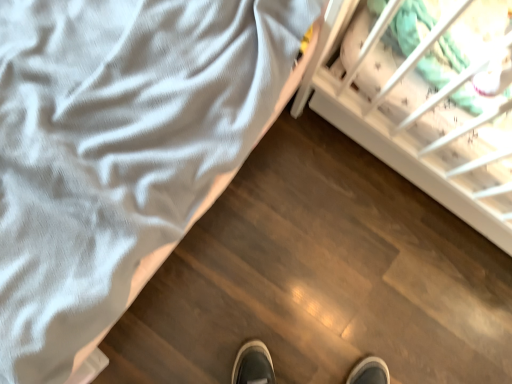
Describe the element at coordinates (117, 148) in the screenshot. I see `white soft bed at upper left` at that location.

Identify the location of white soft bed at upper left. (117, 148).

Locate an element on the screen. This screenshot has width=512, height=384. white soft bed at upper left is located at coordinates (117, 148).